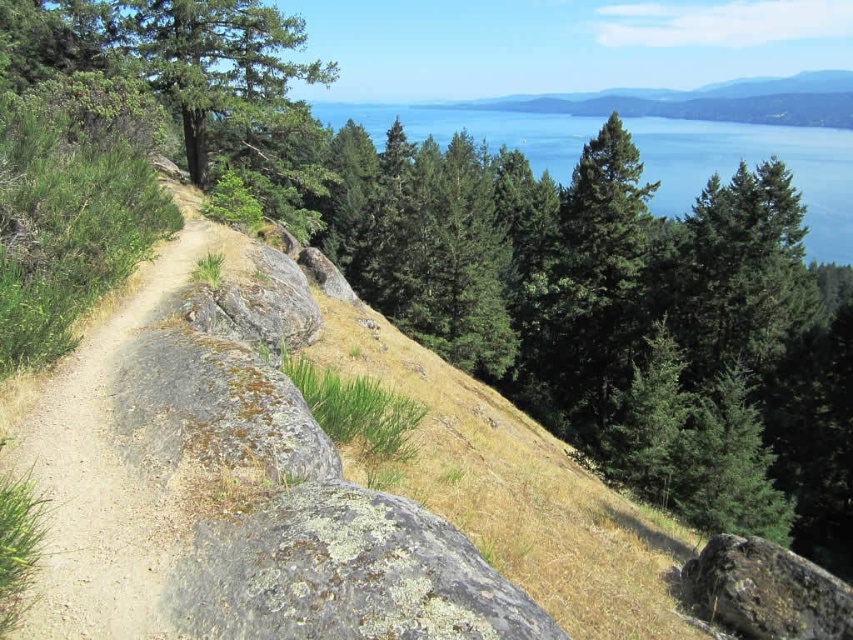
You are planning to take a photo of the blue water at upper center and green mossy rock at center. Which object will occupy more space in your photo?

The blue water at upper center is bigger than the green mossy rock at center, so it will occupy more space in the photo.

You are a hiker who wants to take a photo of the blue water at upper center and the green mossy rock at center. Which object is positioned higher in the image?

The blue water at upper center is positioned higher than the green mossy rock at center.